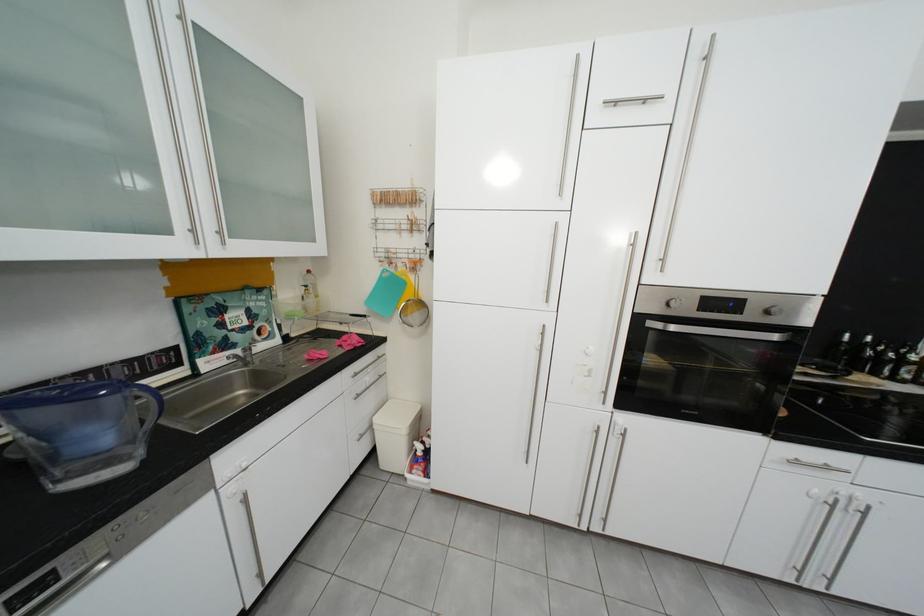
Find where to lift the yellow handle sieve. Please return your answer as a coordinate pair (x, y).

(406, 286)